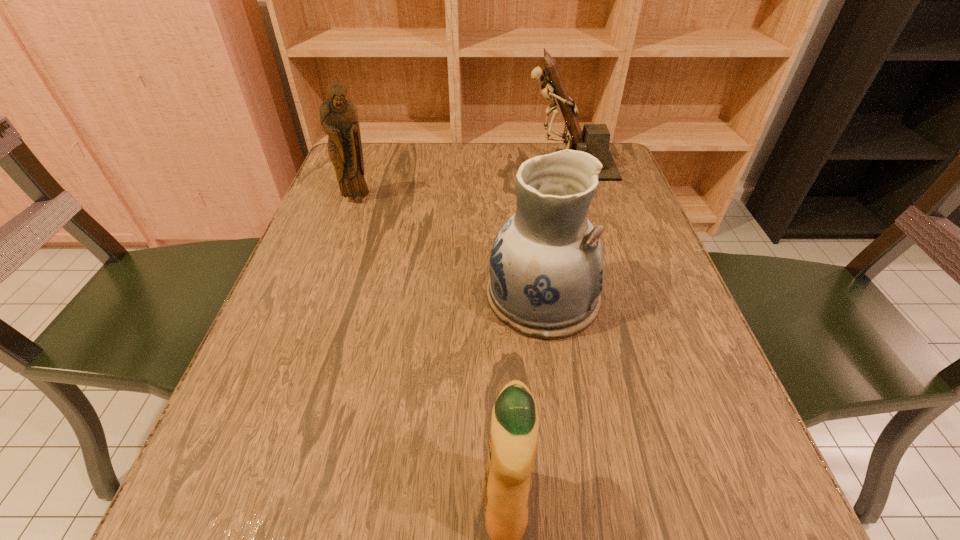
The width and height of the screenshot is (960, 540). I want to click on unoccupied area between the second nearest object and the nearer figurine, so click(450, 248).

Find the location of a particular element. unoccupied position between the right figurine and the left figurine is located at coordinates (464, 183).

At what (x,y) coordinates should I click in order to perform the action: click on free space that is in between the farther figurine and the left figurine. Please return your answer as a coordinate pair (x, y). The height and width of the screenshot is (540, 960). Looking at the image, I should click on (464, 183).

You are a GUI agent. You are given a task and a screenshot of the screen. Output one action in this format:
    pyautogui.click(x=<x>, y=<y>)
    Task: Click on the free space between the right figurine and the third nearest object
    This screenshot has width=960, height=540.
    Given the screenshot: What is the action you would take?
    pyautogui.click(x=464, y=183)

Locate which object is the third closest to the third nearest object. Please provide its 2D coordinates. Your answer should be formatted as a tuple, i.e. [(x, y)], where the tuple contains the x and y coordinates of a point satisfying the conditions above.

[(514, 429)]

Locate an element on the screen. Image resolution: width=960 pixels, height=540 pixels. object that can be found as the third closest to the nearer figurine is located at coordinates (514, 429).

This screenshot has height=540, width=960. I want to click on vacant space that satisfies the following two spatial constraints: 1. on the front-facing side of the farther figurine; 2. on the front-facing side of the left figurine, so [x=579, y=200].